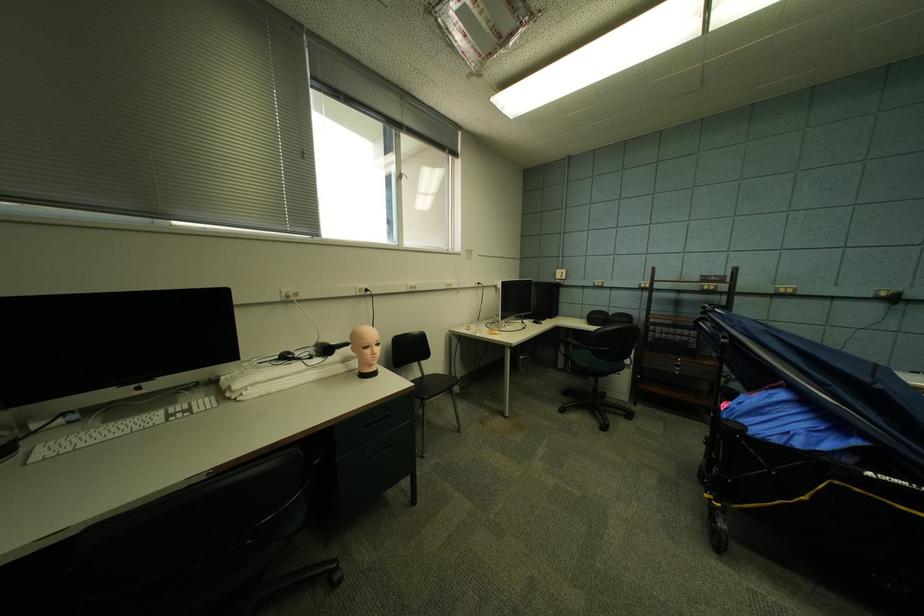
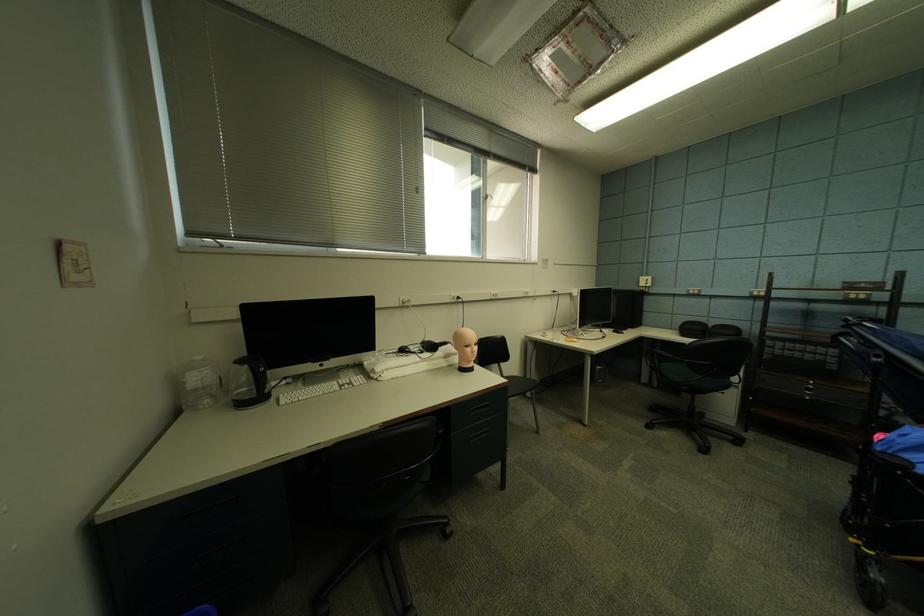
The point at (398,448) is marked in the first image. Where is the corresponding point in the second image?

(495, 432)